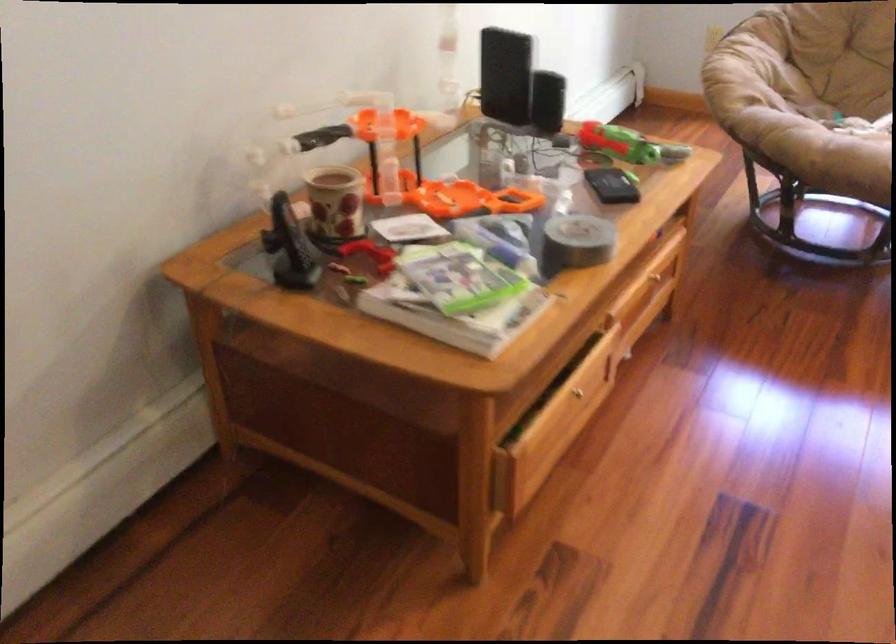
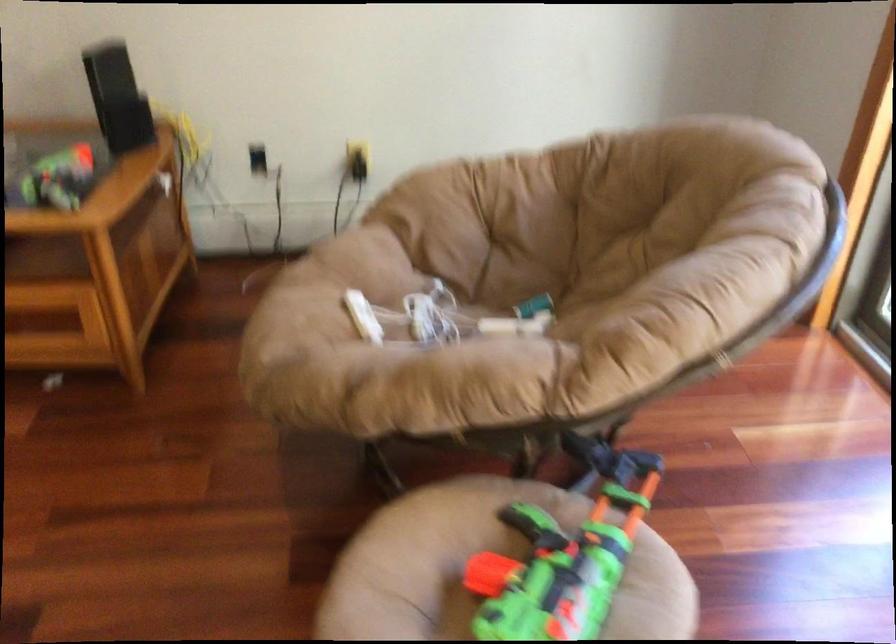
Where in the second image is the point corresponding to point (691, 196) from the first image?

(95, 263)